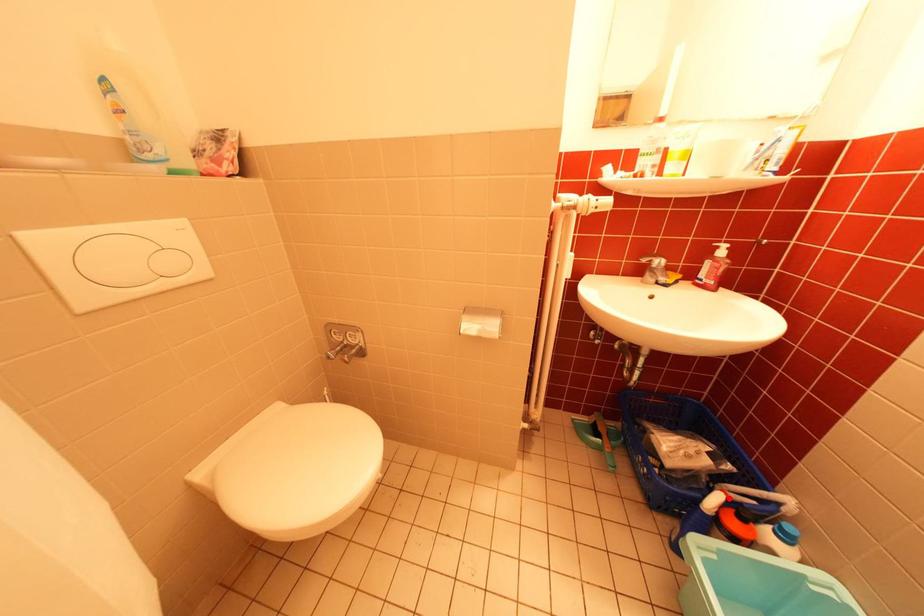
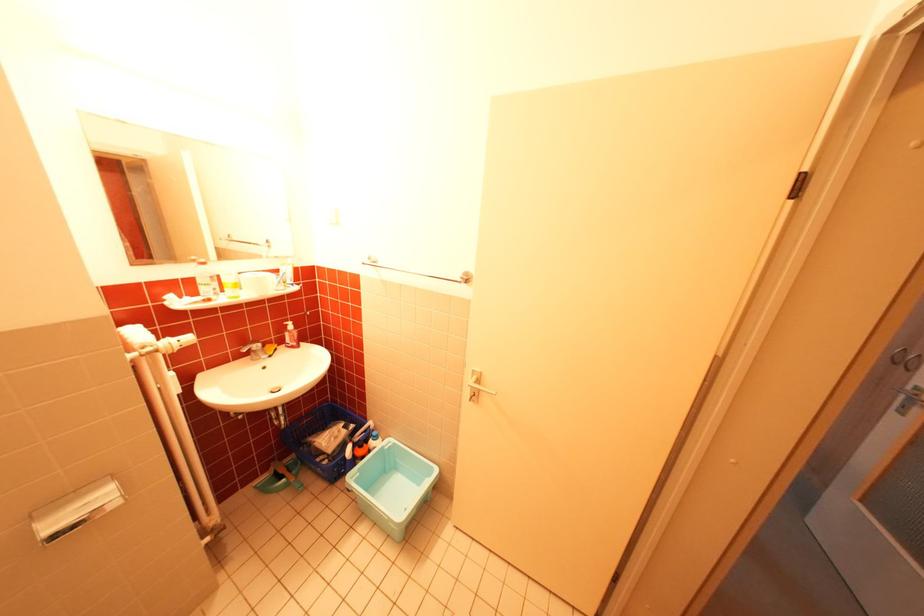
Find the pixel in the second image that matches the highlighted location in the first image.

(360, 448)